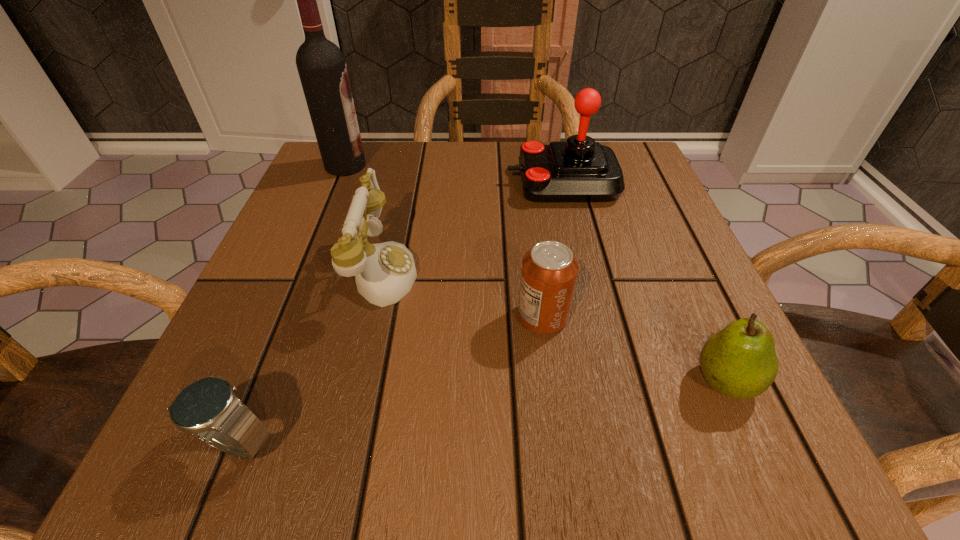
Find the location of a particular element. This screenshot has width=960, height=540. the tallest object is located at coordinates (321, 65).

Locate an element on the screen. The image size is (960, 540). the fifth shortest object is located at coordinates (579, 169).

Locate an element on the screen. telephone is located at coordinates (385, 272).

At what (x,y) coordinates should I click in order to perform the action: click on can. Please return your answer as a coordinate pair (x, y). Looking at the image, I should click on (549, 272).

You are a GUI agent. You are given a task and a screenshot of the screen. Output one action in this format:
    pyautogui.click(x=<x>, y=<y>)
    Task: Click on the fifth farthest object
    
    Given the screenshot: What is the action you would take?
    pyautogui.click(x=739, y=361)

The height and width of the screenshot is (540, 960). Find the location of `the shortest object`. the shortest object is located at coordinates (208, 408).

This screenshot has height=540, width=960. What are the coordinates of `the nearest object` in the screenshot? It's located at (208, 408).

Identify the location of vacant space located on the label of the tallest object. This screenshot has width=960, height=540. (500, 166).

Locate an element on the screen. free space located on the base of the fifth shortest object is located at coordinates (332, 183).

Locate an element on the screen. The height and width of the screenshot is (540, 960). free space located on the base of the fifth shortest object is located at coordinates (465, 183).